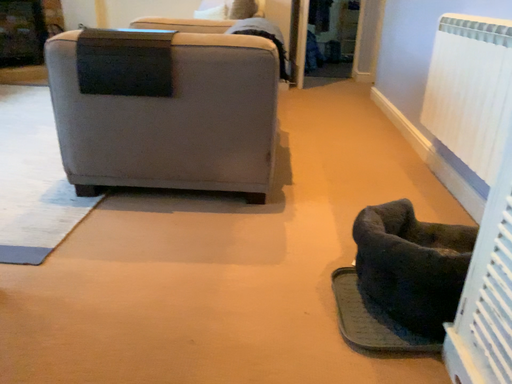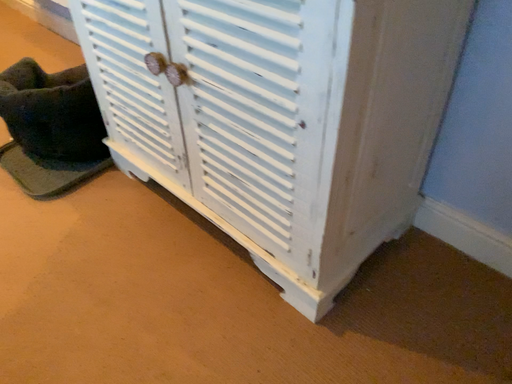
Question: How did the camera likely rotate when shooting the video?

Choices:
 (A) rotated left
 (B) rotated right

Answer: (B)